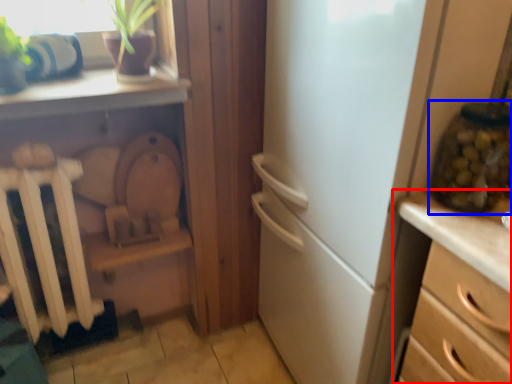
Question: Which of the following is the farthest to the observer, chest of drawers (highlighted by a red box) or glass jar (highlighted by a blue box)?

Choices:
 (A) chest of drawers
 (B) glass jar

Answer: (B)